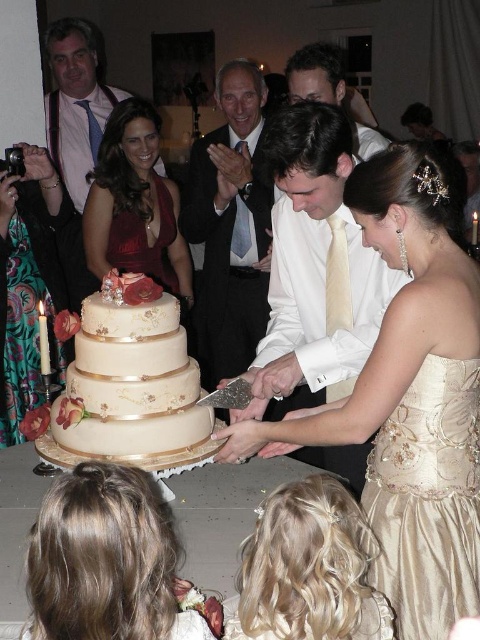
Looking at this image, please look at the image and locate the point at coordinates (409, 394). What object is exactly at that point?

The point at coordinates (409, 394) is exactly where the gold satin dress at center is located.

You are a photographer at the wedding reception. You need to capture a photo of the dark blue suit at center and the velvet burgundy dress at center. Which one is closer to the camera?

The dark blue suit at center is closer to the camera because it is in front of the velvet burgundy dress at center.